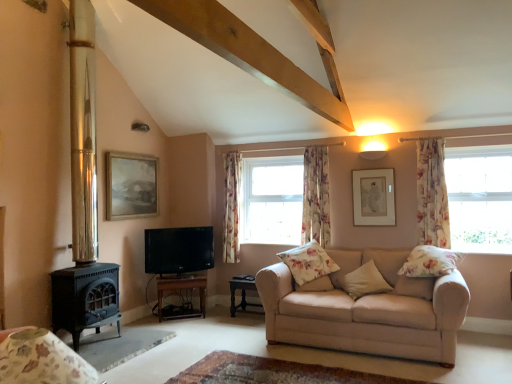
The height and width of the screenshot is (384, 512). Find the location of `empty space that is to the right of polished brass fireplace at left`. empty space that is to the right of polished brass fireplace at left is located at coordinates (143, 340).